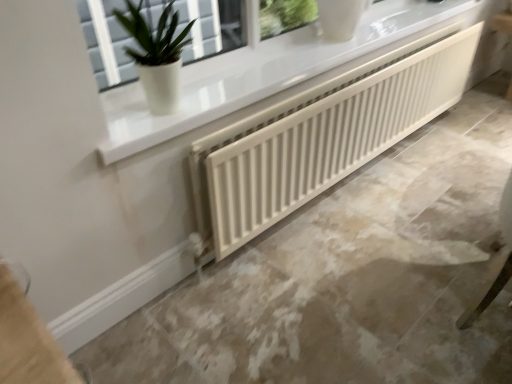
Question: From the image's perspective, is white ribbed radiator at center below green matte plant at upper left?

Choices:
 (A) yes
 (B) no

Answer: (A)

Question: Can you see white ribbed radiator at center touching green matte plant at upper left?

Choices:
 (A) yes
 (B) no

Answer: (B)

Question: Does white ribbed radiator at center have a smaller size compared to green matte plant at upper left?

Choices:
 (A) yes
 (B) no

Answer: (B)

Question: Considering the relative positions of white ribbed radiator at center and green matte plant at upper left in the image provided, is white ribbed radiator at center to the left of green matte plant at upper left from the viewer's perspective?

Choices:
 (A) yes
 (B) no

Answer: (B)

Question: Are white ribbed radiator at center and green matte plant at upper left located far from each other?

Choices:
 (A) no
 (B) yes

Answer: (A)

Question: Considering the relative sizes of white ribbed radiator at center and green matte plant at upper left in the image provided, is white ribbed radiator at center taller than green matte plant at upper left?

Choices:
 (A) yes
 (B) no

Answer: (A)

Question: Is green matte plant at upper left further to the viewer compared to white ribbed radiator at center?

Choices:
 (A) yes
 (B) no

Answer: (B)

Question: Considering the relative positions of green matte plant at upper left and white ribbed radiator at center in the image provided, is green matte plant at upper left to the right of white ribbed radiator at center from the viewer's perspective?

Choices:
 (A) no
 (B) yes

Answer: (A)

Question: From the image's perspective, is green matte plant at upper left beneath white ribbed radiator at center?

Choices:
 (A) no
 (B) yes

Answer: (A)

Question: Is green matte plant at upper left positioned far away from white ribbed radiator at center?

Choices:
 (A) yes
 (B) no

Answer: (B)

Question: Can you confirm if green matte plant at upper left is shorter than white ribbed radiator at center?

Choices:
 (A) yes
 (B) no

Answer: (A)

Question: Is white ribbed radiator at center a part of green matte plant at upper left?

Choices:
 (A) no
 (B) yes

Answer: (A)

Question: Can you confirm if white matte radiator at center is thinner than white ribbed radiator at center?

Choices:
 (A) no
 (B) yes

Answer: (A)